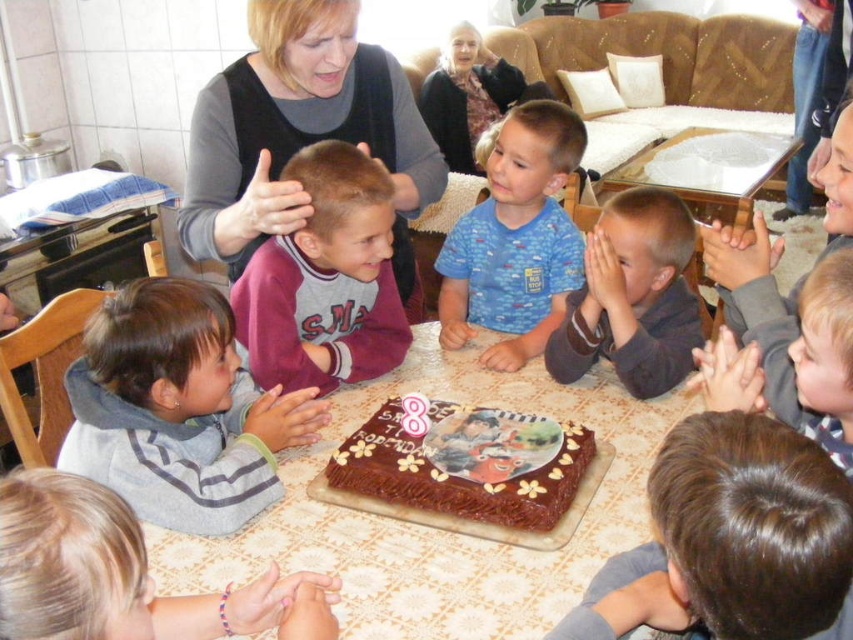
The image size is (853, 640). What do you see at coordinates (732, 540) in the screenshot?
I see `brown matte hair at lower right` at bounding box center [732, 540].

Which is more to the right, brown matte hair at lower right or gray fleece jacket at lower left?

From the viewer's perspective, brown matte hair at lower right appears more on the right side.

Who is more distant from viewer, (x=795, y=570) or (x=207, y=532)?

Point (x=207, y=532)

The height and width of the screenshot is (640, 853). In order to click on brown matte hair at lower right in this screenshot , I will do coord(732,540).

Is gray fleece jacket at lower left thinner than matte gray sweater at upper left?

Correct, gray fleece jacket at lower left's width is less than matte gray sweater at upper left's.

Is gray fleece jacket at lower left to the left of matte gray sweater at upper left from the viewer's perspective?

A: Yes, gray fleece jacket at lower left is to the left of matte gray sweater at upper left.

Is point (202, 422) positioned before point (241, 198)?

Yes, point (202, 422) is closer to viewer.

Where is `gray fleece jacket at lower left`? The image size is (853, 640). gray fleece jacket at lower left is located at coordinates (178, 410).

Does matte gray sweater at upper left appear under smooth brown shirt at center?

No, matte gray sweater at upper left is not below smooth brown shirt at center.

Which is below, matte gray sweater at upper left or smooth brown shirt at center?

smooth brown shirt at center

Where is `matte gray sweater at upper left`? Image resolution: width=853 pixels, height=640 pixels. matte gray sweater at upper left is located at coordinates (299, 131).